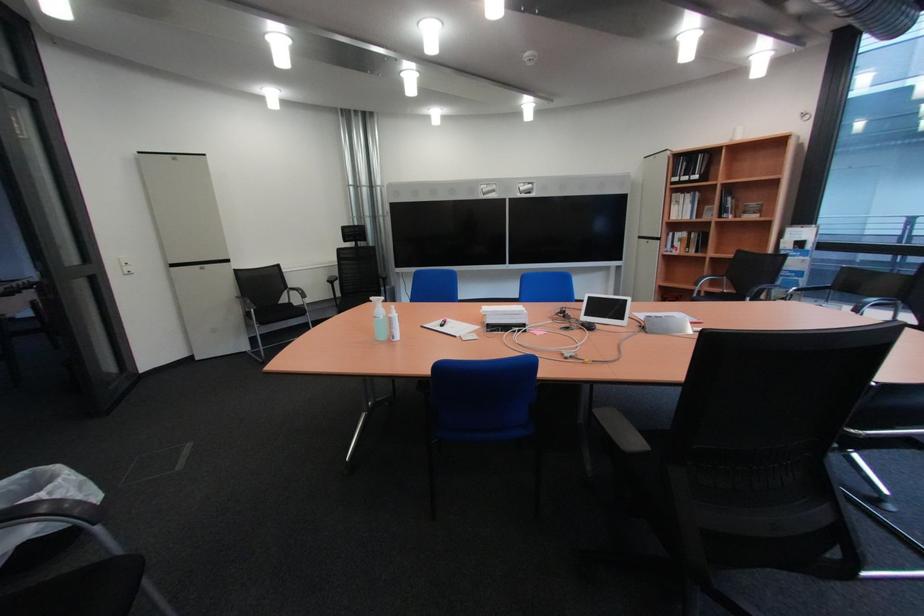
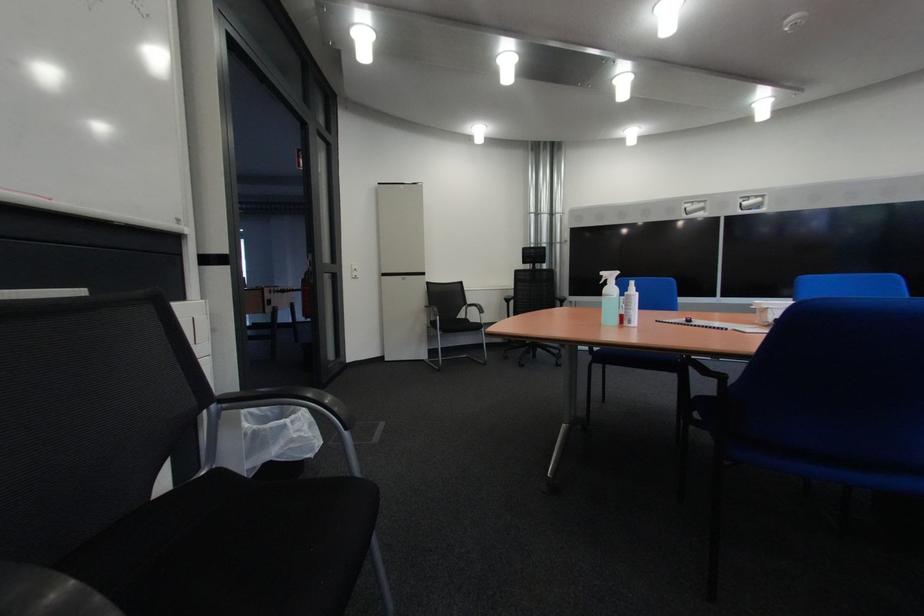
Which direction would the cameraman need to move to produce the second image?

The cameraman moved toward left, forward.